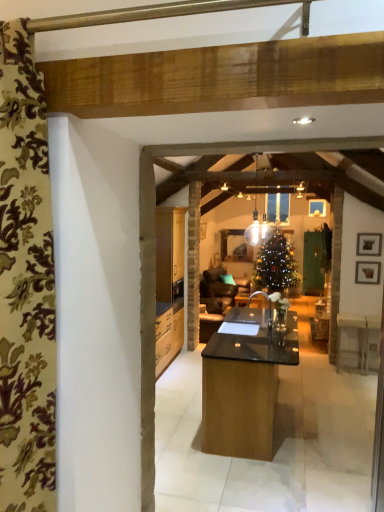
Question: From the image's perspective, does black matte picture frame at upper right, which is the first picture frame from top to bottom, appear higher than wooden picture frame at right, which is the 2th picture frame from top to bottom?

Choices:
 (A) no
 (B) yes

Answer: (B)

Question: From a real-world perspective, is black matte picture frame at upper right, the 2th picture frame positioned from the bottom, beneath wooden picture frame at right, the first picture frame in the bottom-to-top sequence?

Choices:
 (A) no
 (B) yes

Answer: (A)

Question: Does black matte picture frame at upper right, which is the first picture frame from top to bottom, lie behind wooden picture frame at right, the first picture frame in the bottom-to-top sequence?

Choices:
 (A) no
 (B) yes

Answer: (A)

Question: Is wooden picture frame at right, the first picture frame in the bottom-to-top sequence, completely or partially inside black matte picture frame at upper right, the 2th picture frame positioned from the bottom?

Choices:
 (A) no
 (B) yes

Answer: (A)

Question: Is black matte picture frame at upper right, which is the first picture frame from top to bottom, shorter than wooden picture frame at right, which is the 2th picture frame from top to bottom?

Choices:
 (A) no
 (B) yes

Answer: (A)

Question: Is black matte picture frame at upper right, the 2th picture frame positioned from the bottom, not near wooden picture frame at right, which is the 2th picture frame from top to bottom?

Choices:
 (A) yes
 (B) no

Answer: (B)

Question: Does wooden picture frame at right, the first picture frame in the bottom-to-top sequence, contain translucent glass pendant light at center?

Choices:
 (A) yes
 (B) no

Answer: (B)

Question: Is wooden picture frame at right, the first picture frame in the bottom-to-top sequence, bigger than translucent glass pendant light at center?

Choices:
 (A) no
 (B) yes

Answer: (A)

Question: From a real-world perspective, is wooden picture frame at right, the first picture frame in the bottom-to-top sequence, located higher than translucent glass pendant light at center?

Choices:
 (A) no
 (B) yes

Answer: (A)

Question: Is wooden picture frame at right, which is the 2th picture frame from top to bottom, completely or partially outside of translucent glass pendant light at center?

Choices:
 (A) yes
 (B) no

Answer: (A)

Question: Is wooden picture frame at right, which is the 2th picture frame from top to bottom, positioned before translucent glass pendant light at center?

Choices:
 (A) yes
 (B) no

Answer: (B)

Question: Is translucent glass pendant light at center at the back of wooden picture frame at right, which is the 2th picture frame from top to bottom?

Choices:
 (A) no
 (B) yes

Answer: (A)

Question: Is translucent glass pendant light at center positioned in front of floral fabric curtain at left?

Choices:
 (A) no
 (B) yes

Answer: (A)